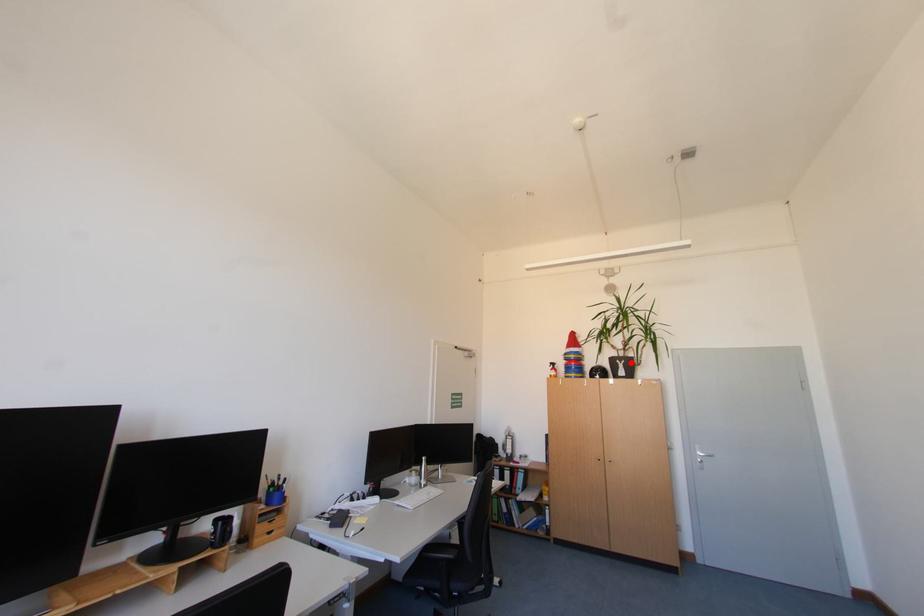
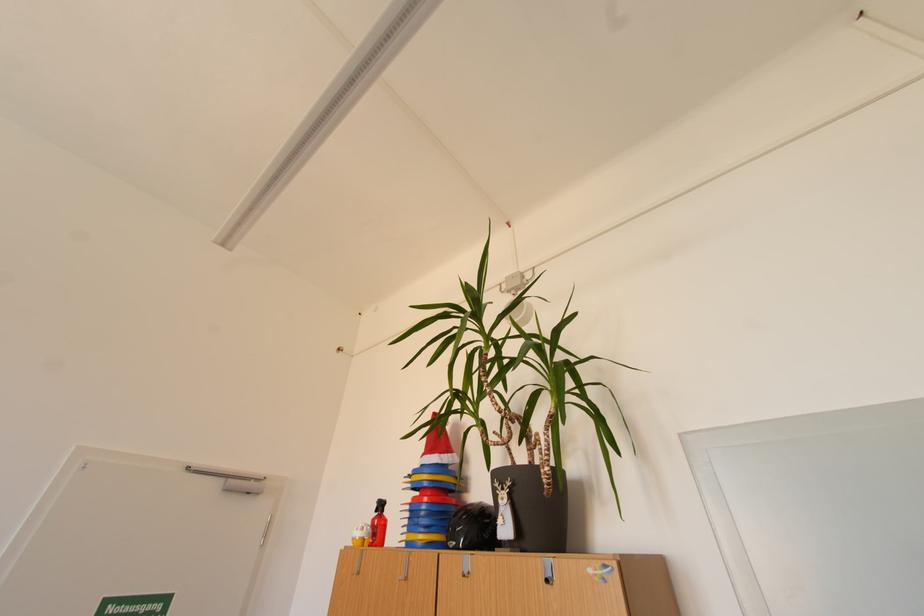
Find the pixel in the second image that matches the highlighted location in the first image.

(517, 485)